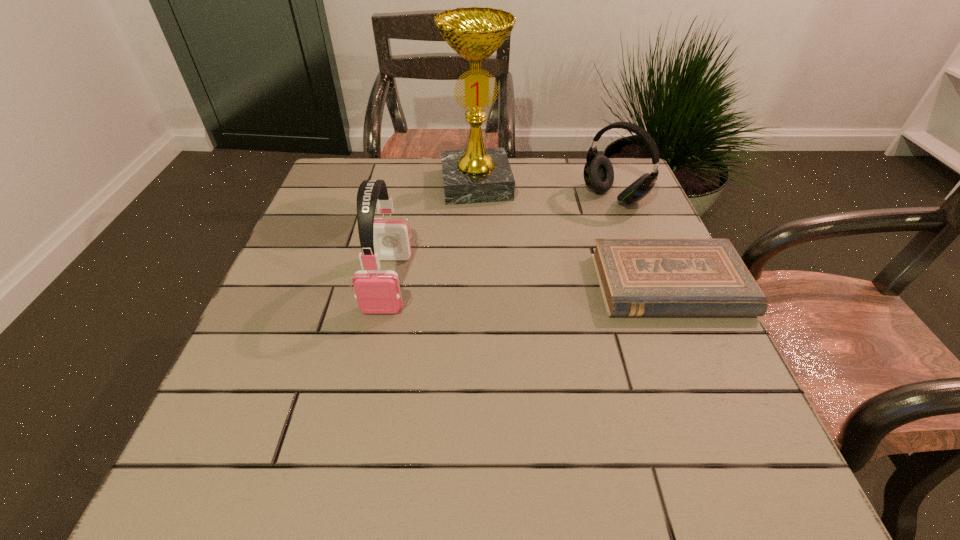
In order to click on vacant region at the near edge of the desktop in this screenshot , I will do `click(409, 421)`.

Image resolution: width=960 pixels, height=540 pixels. I want to click on vacant region at the left edge of the desktop, so click(x=297, y=320).

Locate an element on the screen. The width and height of the screenshot is (960, 540). free spot at the right edge of the desktop is located at coordinates (642, 333).

This screenshot has width=960, height=540. In order to click on vacant space at the near left corner of the desktop in this screenshot , I will do (x=264, y=428).

In the image, there is a desktop. Identify the location of vacant space at the far right corner. (614, 160).

Where is `free space between the third shortest object and the Bible`? This screenshot has height=540, width=960. free space between the third shortest object and the Bible is located at coordinates [529, 284].

Find the location of a particular element. free space between the third tallest object and the tallest object is located at coordinates (545, 191).

Where is `vacant area between the third shortest object and the third tallest object`? Image resolution: width=960 pixels, height=540 pixels. vacant area between the third shortest object and the third tallest object is located at coordinates (501, 240).

Locate an element on the screen. unoccupied position between the headset and the leftmost object is located at coordinates (501, 240).

The image size is (960, 540). What are the coordinates of `vacant area that lies between the third tallest object and the tallest object` in the screenshot? It's located at (545, 191).